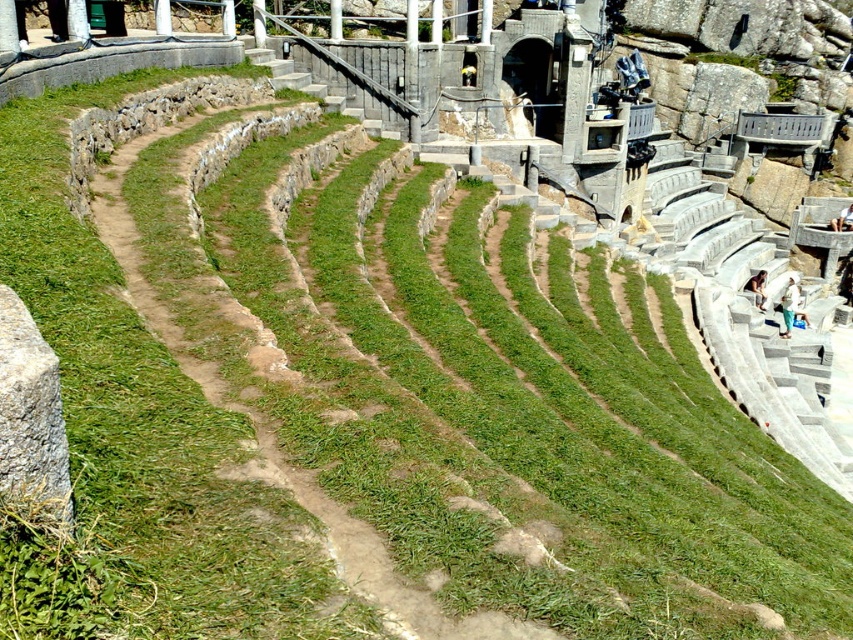
You are planning to place a small garden statue that is 0.5 meters wide on the path. The gray rough stone at lower left and the light brown stone person at lower right are nearby. Which stone object can the statue fit next to without overlapping?

The gray rough stone at lower left has a width less than the light brown stone person at lower right. Since the statue is 0.5 meters wide, it can fit next to the gray rough stone at lower left as there is enough space.

You are standing at the entrance of the amphitheater and see a white cotton shirt at lower right and a light brown stone person at lower right. If you want to pick up both items, which one should you go to first to minimize the distance walked?

You should go to the white cotton shirt at lower right first since it is closer to you than the light brown stone person at lower right, as they are 3.60 meters apart.